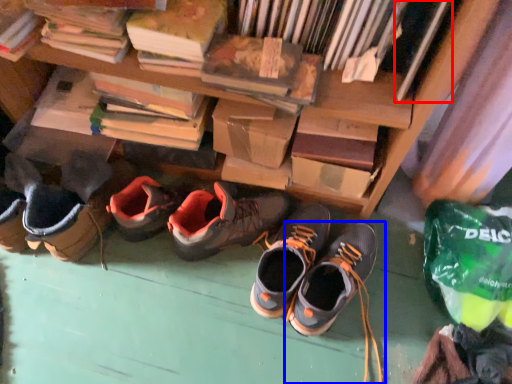
Question: Which point is closer to the camera, book (highlighted by a red box) or footwear (highlighted by a blue box)?

Choices:
 (A) book
 (B) footwear

Answer: (A)